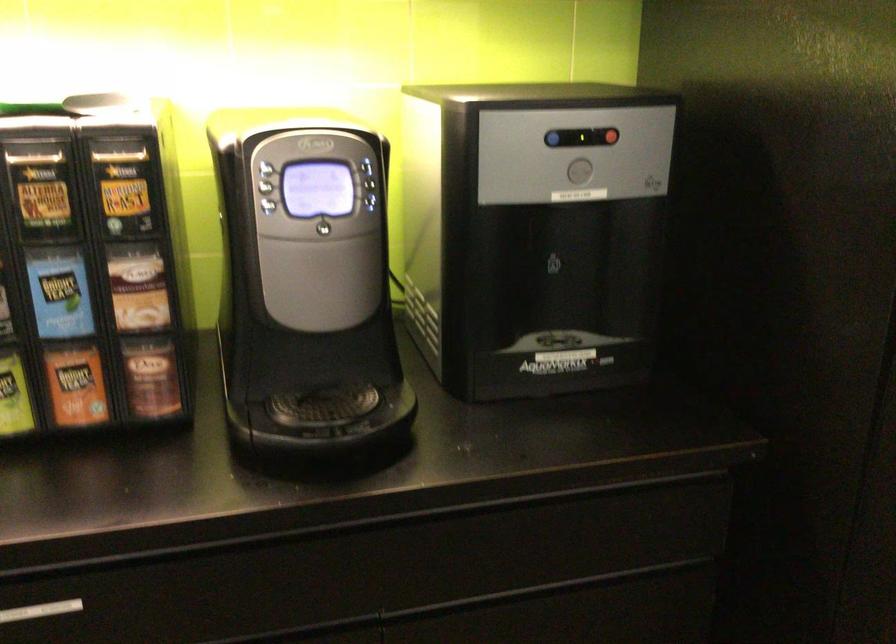
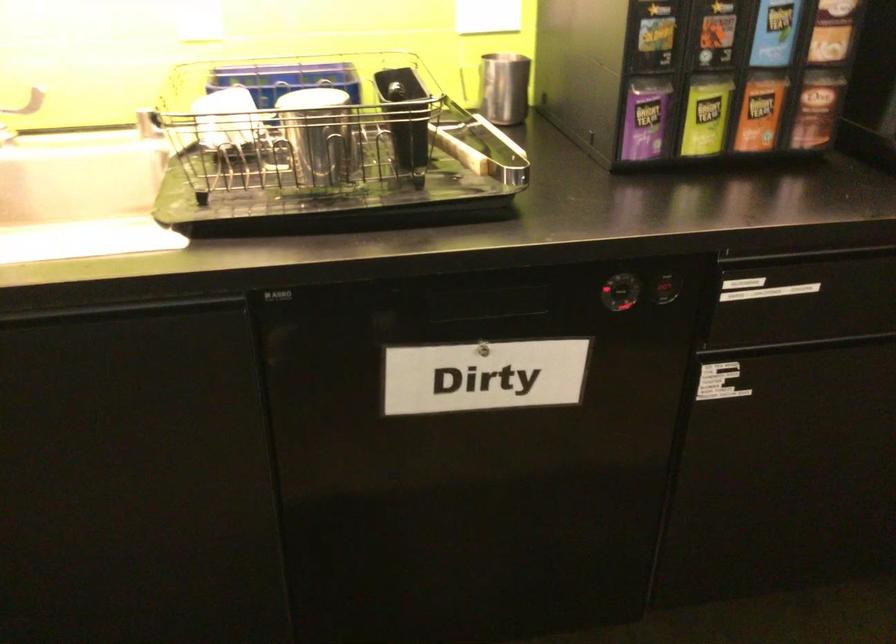
Locate, in the second image, the point that corresponds to (80,381) in the first image.

(760, 111)